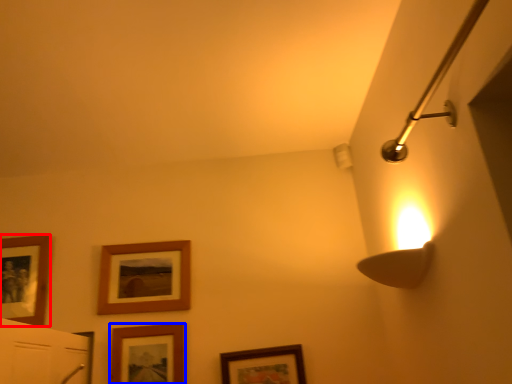
Question: Which point is further to the camera, picture frame (highlighted by a red box) or picture frame (highlighted by a blue box)?

Choices:
 (A) picture frame
 (B) picture frame

Answer: (A)